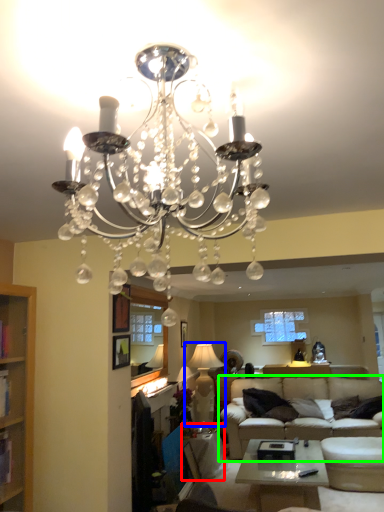
Question: Estimate the real-world distances between objects in this image. Which object is closer to side table (highlighted by a red box), lamp (highlighted by a blue box) or studio couch (highlighted by a green box)?

Choices:
 (A) lamp
 (B) studio couch

Answer: (B)